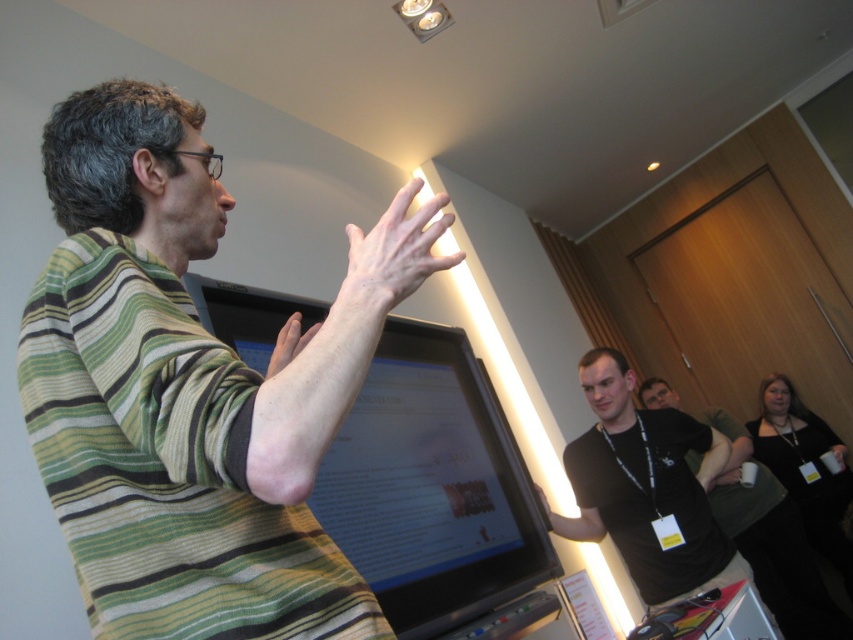
Question: Which point is farther to the camera?

Choices:
 (A) pale skin/hair at upper center
 (B) striped cotton shirt at center
 (C) matte black hand at center

Answer: (C)

Question: Which object is positioned closest to the matte skin hand at upper center?

Choices:
 (A) matte black hand at center
 (B) black matte shirt at right
 (C) pale skin/hair at upper center
 (D) striped cotton shirt at center

Answer: (C)

Question: Which object is positioned farthest from the black fabric shirt at lower right?

Choices:
 (A) matte skin hand at upper center
 (B) black matte shirt at right
 (C) matte black hand at center

Answer: (A)

Question: Does black matte shirt at right have a lesser width compared to black fabric shirt at lower right?

Choices:
 (A) yes
 (B) no

Answer: (A)

Question: Is matte skin hand at upper center to the left of matte black hand at center from the viewer's perspective?

Choices:
 (A) yes
 (B) no

Answer: (A)

Question: Does pale skin/hair at upper center have a lesser width compared to matte black hand at center?

Choices:
 (A) no
 (B) yes

Answer: (A)